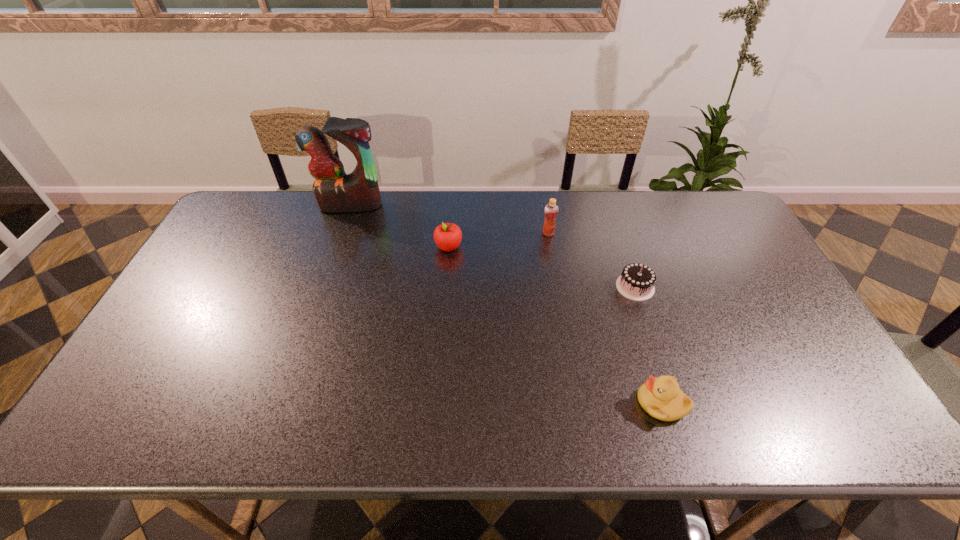
In order to click on vacant space located on the front of the apple in this screenshot , I will do `click(444, 317)`.

Where is `vacant space located on the front-facing side of the nearest object`? vacant space located on the front-facing side of the nearest object is located at coordinates (499, 403).

Image resolution: width=960 pixels, height=540 pixels. Identify the location of blank space located 0.300m on the front-facing side of the nearest object. (508, 403).

Where is `vacant space positioned 0.320m on the front-facing side of the nearest object`? vacant space positioned 0.320m on the front-facing side of the nearest object is located at coordinates (499, 403).

Locate an element on the screen. The height and width of the screenshot is (540, 960). vacant region located on the back of the chocolate cake is located at coordinates (623, 251).

Where is `parrot that is at the far edge`? The image size is (960, 540). parrot that is at the far edge is located at coordinates (335, 191).

At what (x,y) coordinates should I click in order to perform the action: click on orange juice at the far edge. Please return your answer as a coordinate pair (x, y). This screenshot has width=960, height=540. Looking at the image, I should click on (551, 210).

I want to click on object at the near edge, so click(661, 398).

You are a GUI agent. You are given a task and a screenshot of the screen. Output one action in this format:
    pyautogui.click(x=<x>, y=<y>)
    Task: Click on the vacant space at the far edge of the desktop
    
    Given the screenshot: What is the action you would take?
    pyautogui.click(x=538, y=215)

Locate an element on the screen. This screenshot has width=960, height=540. vacant space at the near edge of the desktop is located at coordinates (289, 424).